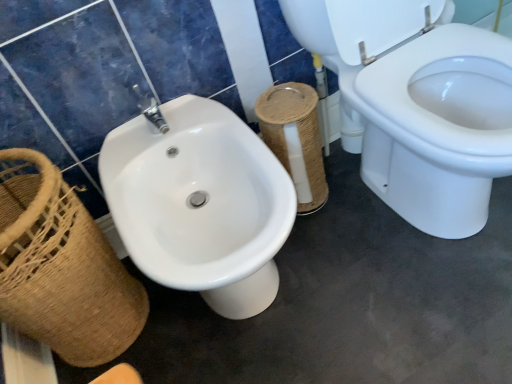
Question: Is brown woven basket at left smaller than woven brown toilet paper at center?

Choices:
 (A) yes
 (B) no

Answer: (B)

Question: Does brown woven basket at left come in front of woven brown toilet paper at center?

Choices:
 (A) yes
 (B) no

Answer: (A)

Question: Is brown woven basket at left bigger than woven brown toilet paper at center?

Choices:
 (A) yes
 (B) no

Answer: (A)

Question: Is brown woven basket at left far from woven brown toilet paper at center?

Choices:
 (A) no
 (B) yes

Answer: (A)

Question: Does brown woven basket at left come behind woven brown toilet paper at center?

Choices:
 (A) yes
 (B) no

Answer: (B)

Question: Can you confirm if brown woven basket at left is taller than woven brown toilet paper at center?

Choices:
 (A) yes
 (B) no

Answer: (A)

Question: Is woven brown toilet paper at center bigger than brown woven basket at left?

Choices:
 (A) no
 (B) yes

Answer: (A)

Question: Considering the relative sizes of woven brown toilet paper at center and brown woven basket at left in the image provided, is woven brown toilet paper at center taller than brown woven basket at left?

Choices:
 (A) no
 (B) yes

Answer: (A)

Question: From the image's perspective, would you say woven brown toilet paper at center is positioned over brown woven basket at left?

Choices:
 (A) no
 (B) yes

Answer: (B)

Question: Is the surface of woven brown toilet paper at center in direct contact with brown woven basket at left?

Choices:
 (A) no
 (B) yes

Answer: (A)

Question: Does woven brown toilet paper at center turn towards brown woven basket at left?

Choices:
 (A) yes
 (B) no

Answer: (B)

Question: Does woven brown toilet paper at center have a smaller size compared to brown woven basket at left?

Choices:
 (A) no
 (B) yes

Answer: (B)

Question: Visually, is woven brown toilet paper at center positioned to the left or to the right of brown woven basket at left?

Choices:
 (A) right
 (B) left

Answer: (A)